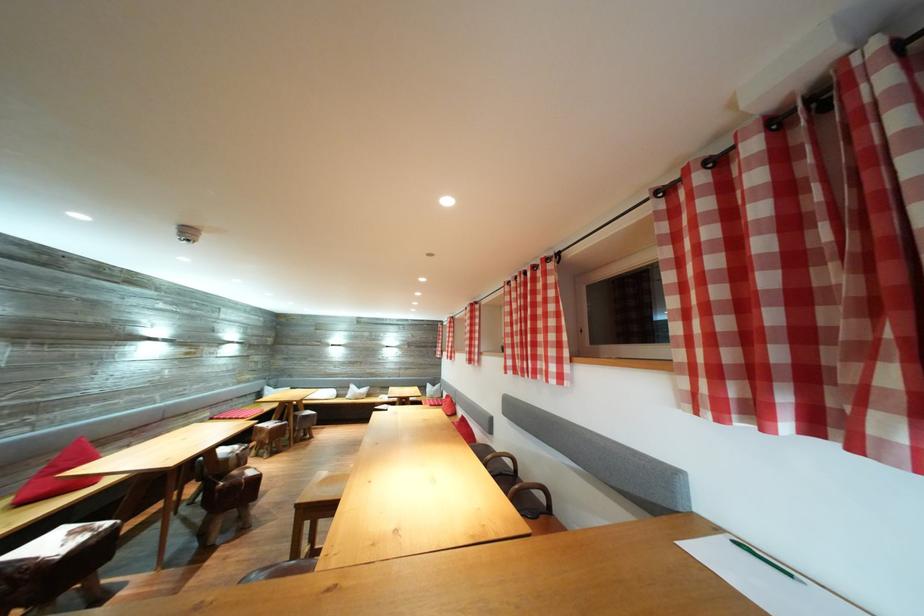
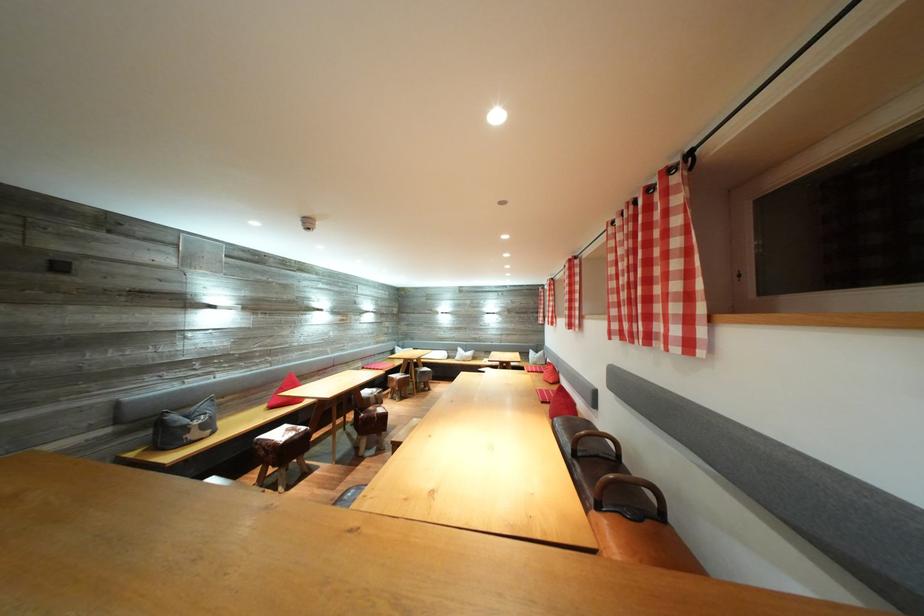
The point at (x=456, y=405) is marked in the first image. Where is the corresponding point in the second image?

(557, 373)